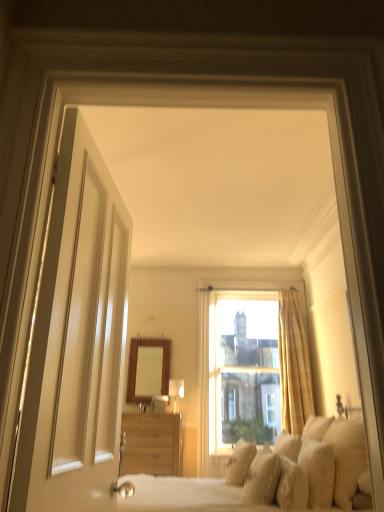
Question: Does white soft pillow at lower right, the 4th pillow viewed from the left, appear on the right side of white textured pillow at lower right, the 2th pillow in the right-to-left sequence?

Choices:
 (A) no
 (B) yes

Answer: (A)

Question: Is white soft pillow at lower right, the 4th pillow viewed from the left, oriented towards white textured pillow at lower right, the 2th pillow in the right-to-left sequence?

Choices:
 (A) no
 (B) yes

Answer: (A)

Question: Can you confirm if white soft pillow at lower right, arranged as the 3th pillow when viewed from the right, is shorter than white textured pillow at lower right, positioned as the fifth pillow in left-to-right order?

Choices:
 (A) yes
 (B) no

Answer: (A)

Question: Can you confirm if white soft pillow at lower right, the 4th pillow viewed from the left, is wider than white textured pillow at lower right, the 2th pillow in the right-to-left sequence?

Choices:
 (A) no
 (B) yes

Answer: (B)

Question: Is white soft pillow at lower right, arranged as the 3th pillow when viewed from the right, in front of white textured pillow at lower right, positioned as the fifth pillow in left-to-right order?

Choices:
 (A) no
 (B) yes

Answer: (A)

Question: Does white soft pillow at lower right, arranged as the 3th pillow when viewed from the right, have a lesser width compared to white textured pillow at lower right, positioned as the fifth pillow in left-to-right order?

Choices:
 (A) no
 (B) yes

Answer: (A)

Question: Is wooden frame mirror at center looking in the opposite direction of soft cream pillows at center?

Choices:
 (A) yes
 (B) no

Answer: (B)

Question: Is there a large distance between wooden frame mirror at center and soft cream pillows at center?

Choices:
 (A) no
 (B) yes

Answer: (B)

Question: Can you confirm if wooden frame mirror at center is smaller than soft cream pillows at center?

Choices:
 (A) yes
 (B) no

Answer: (A)

Question: Is the depth of wooden frame mirror at center less than that of soft cream pillows at center?

Choices:
 (A) no
 (B) yes

Answer: (A)

Question: Could you tell me if wooden frame mirror at center is turned towards soft cream pillows at center?

Choices:
 (A) yes
 (B) no

Answer: (B)

Question: From the image's perspective, would you say wooden frame mirror at center is positioned over soft cream pillows at center?

Choices:
 (A) no
 (B) yes

Answer: (B)

Question: Is white textured pillow at lower right, positioned as the fifth pillow in left-to-right order, taller than white glossy door at left?

Choices:
 (A) yes
 (B) no

Answer: (B)